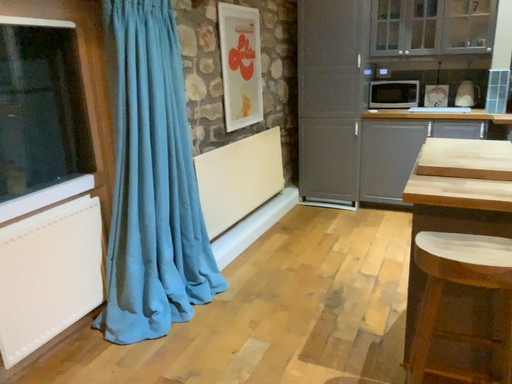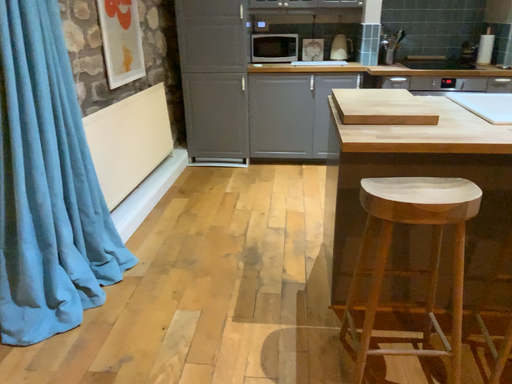
Question: Which way did the camera rotate in the video?

Choices:
 (A) rotated left
 (B) rotated right

Answer: (B)